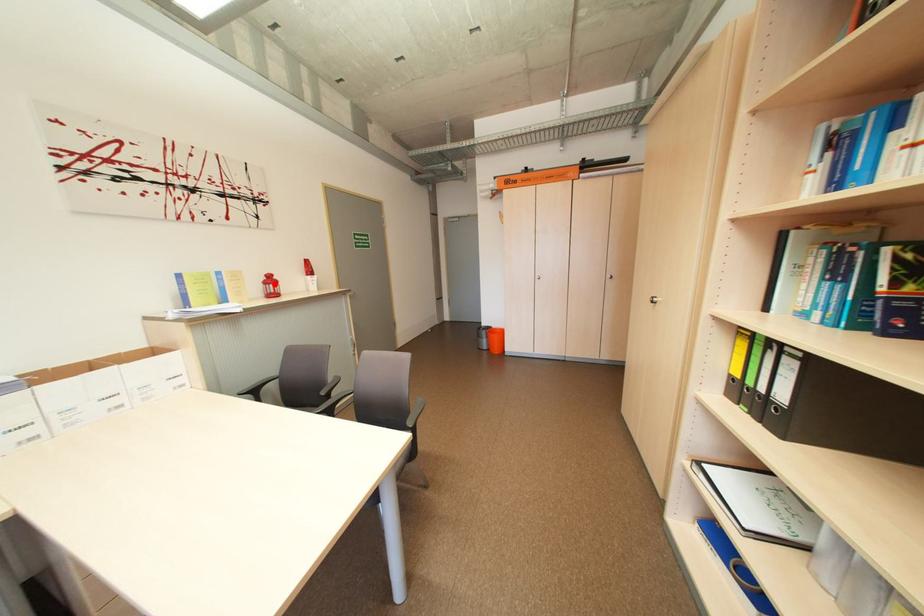
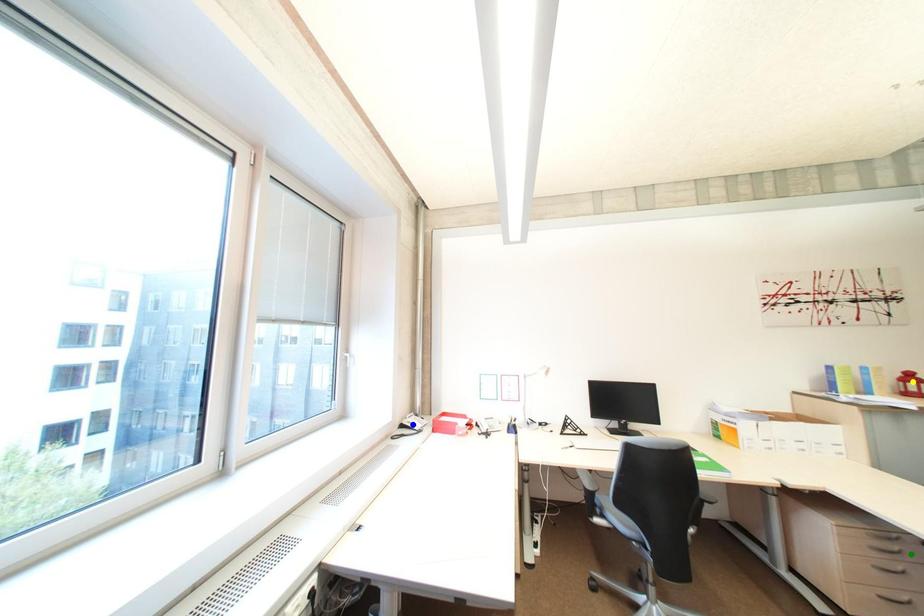
Question: I am providing you with two images of the same scene from different viewpoints. A red point is marked on the first image. You are given multiple points on the second image. Which point in image 2 is actually the same real-world point as the red point in image 1?

Choices:
 (A) blue point
 (B) yellow point
 (C) green point

Answer: (B)